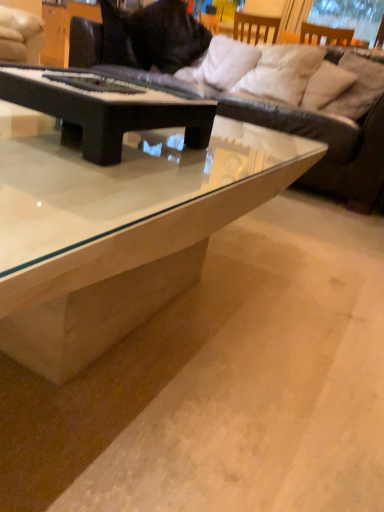
You are a GUI agent. You are given a task and a screenshot of the screen. Output one action in this format:
    pyautogui.click(x=<x>, y=<y>)
    Task: Click on the vacant area located to the right-hand side of black matte piano at center, which is the 1th coffee table from back to front
    The image size is (384, 512).
    Given the screenshot: What is the action you would take?
    pyautogui.click(x=214, y=161)